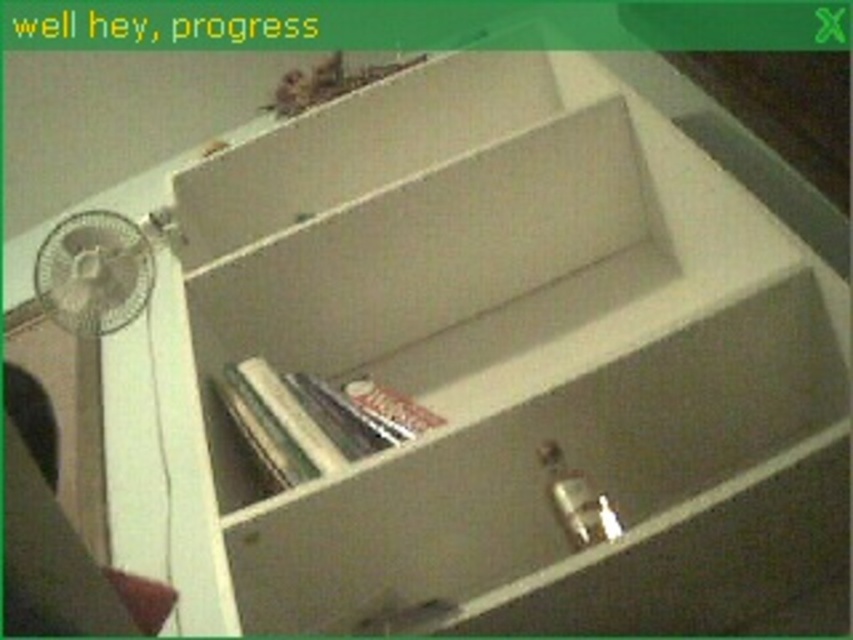
Question: Can you confirm if hardcover book at center is thinner than metallic silver fan at left?

Choices:
 (A) yes
 (B) no

Answer: (B)

Question: Does hardcover book at center appear over metallic silver fan at left?

Choices:
 (A) no
 (B) yes

Answer: (A)

Question: Which object is farther from the camera taking this photo?

Choices:
 (A) hardcover book at center
 (B) metallic silver fan at left

Answer: (B)

Question: From the image, what is the correct spatial relationship of hardcover book at center in relation to metallic silver fan at left?

Choices:
 (A) below
 (B) above

Answer: (A)

Question: Which point is farther to the camera?

Choices:
 (A) (111, 304)
 (B) (363, 378)

Answer: (A)